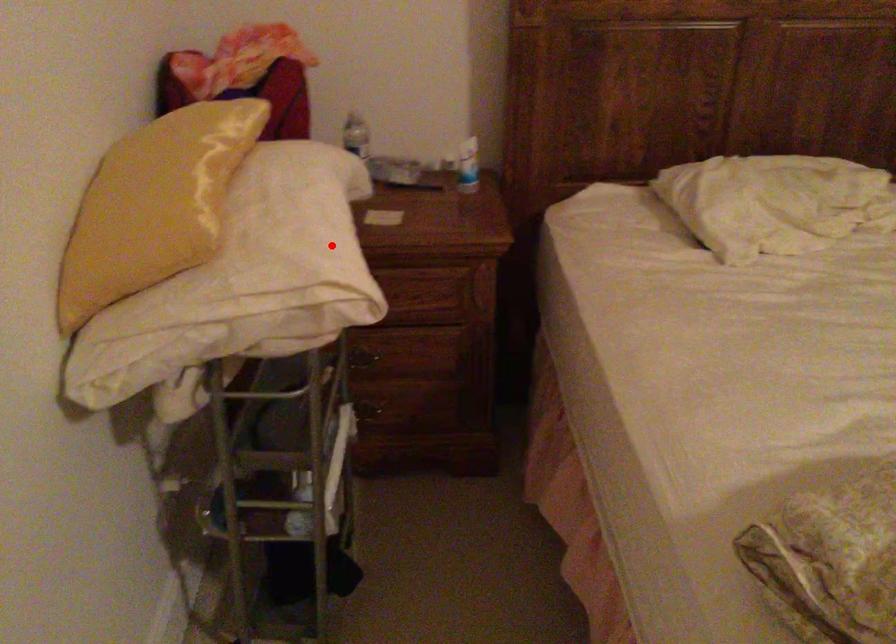
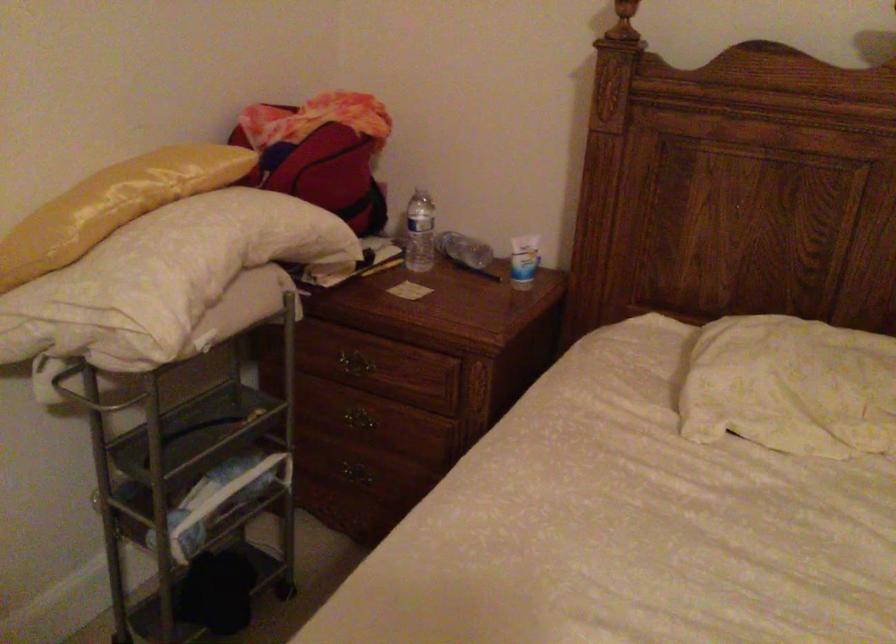
The point at the highlighted location is marked in the first image. Where is the corresponding point in the second image?

(164, 278)